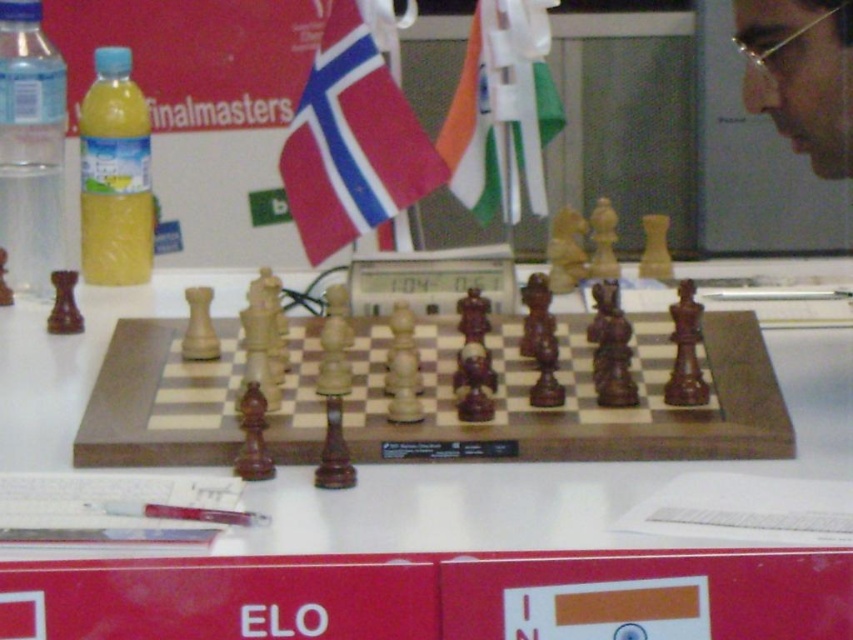
Question: Considering the real-world distances, which object is farthest from the white fabric flag at center?

Choices:
 (A) red fabric flag at center
 (B) clear plastic bottle at left
 (C) yellow translucent bottle at left

Answer: (B)

Question: From the image, what is the correct spatial relationship of red fabric flag at center in relation to clear plastic bottle at left?

Choices:
 (A) below
 (B) above

Answer: (B)

Question: Which of the following is the farthest from the observer?

Choices:
 (A) clear plastic bottle at left
 (B) yellow translucent bottle at left

Answer: (B)

Question: Can you confirm if clear plastic bottle at left is positioned to the left of yellow translucent bottle at left?

Choices:
 (A) yes
 (B) no

Answer: (A)

Question: Is red fabric flag at center bigger than clear plastic bottle at left?

Choices:
 (A) yes
 (B) no

Answer: (A)

Question: Which is farther from the clear plastic bottle at left?

Choices:
 (A) yellow translucent bottle at left
 (B) red fabric flag at center
 (C) white fabric flag at center

Answer: (C)